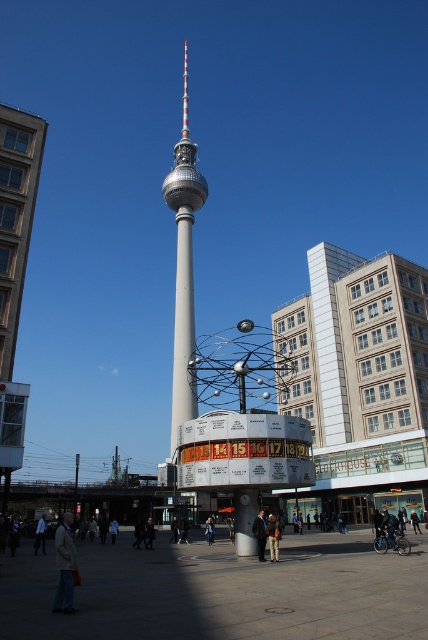
How distant is light gray jacket at lower left from light blue fabric jacket at center?

light gray jacket at lower left and light blue fabric jacket at center are 23.12 meters apart from each other.

Who is positioned more to the right, light gray jacket at lower left or light blue fabric jacket at center?

Positioned to the right is light gray jacket at lower left.

Locate an element on the screen. light gray jacket at lower left is located at coordinates (65, 564).

The height and width of the screenshot is (640, 428). In order to click on light gray jacket at lower left in this screenshot , I will do `click(65, 564)`.

Can you confirm if dark blue leather jacket at center is positioned to the left of light blue fabric jacket at center?

In fact, dark blue leather jacket at center is to the right of light blue fabric jacket at center.

Between point (252, 522) and point (110, 528), which one is positioned in front?

Positioned in front is point (252, 522).

The width and height of the screenshot is (428, 640). Identify the location of dark blue leather jacket at center. (259, 534).

Is silver metallic tower at center closer to the viewer compared to dark gray coat at center?

No, it is not.

Between silver metallic tower at center and dark gray coat at center, which one appears on the right side from the viewer's perspective?

From the viewer's perspective, dark gray coat at center appears more on the right side.

At what (x,y) coordinates should I click in order to perform the action: click on silver metallic tower at center. Please return your answer as a coordinate pair (x, y). Looking at the image, I should click on (184, 266).